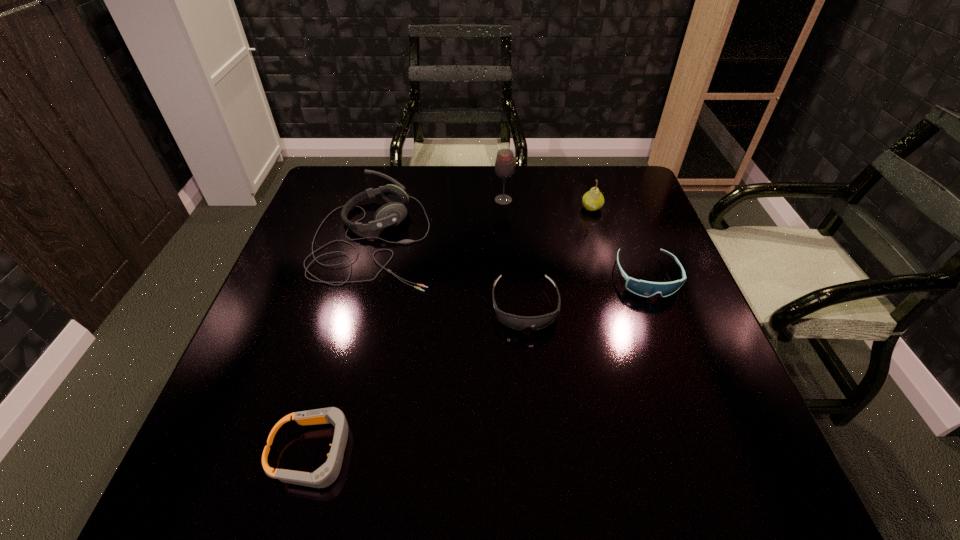
The width and height of the screenshot is (960, 540). Find the location of `glass drink container`. glass drink container is located at coordinates (504, 165).

The image size is (960, 540). I want to click on pear, so click(x=593, y=200).

This screenshot has height=540, width=960. What are the coordinates of `headset` in the screenshot? It's located at (391, 214).

The image size is (960, 540). In order to click on the rightmost goggles in this screenshot , I will do `click(642, 288)`.

Identify the location of the second goggles from left to right. (516, 322).

Identify the location of the leftmost goggles. (325, 475).

I want to click on the nearest goggles, so click(x=325, y=475).

The height and width of the screenshot is (540, 960). I want to click on vacant space situated on the right of the glass drink container, so click(612, 200).

Where is `vacant space located 0.160m on the left of the pear`? vacant space located 0.160m on the left of the pear is located at coordinates (526, 208).

Where is `vacant space located on the outer surface of the headset`? This screenshot has height=540, width=960. vacant space located on the outer surface of the headset is located at coordinates (536, 239).